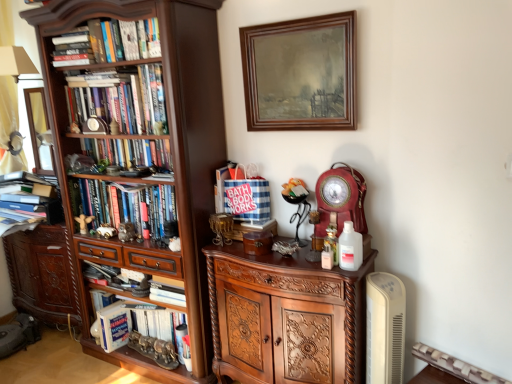
You are a GUI agent. You are given a task and a screenshot of the screen. Output one action in this format:
    pyautogui.click(x=<x>, y=<y>)
    Task: Click on the vacant region above wooden picture frame at upper center (from a real-world perspective)
    
    Given the screenshot: What is the action you would take?
    pyautogui.click(x=295, y=18)